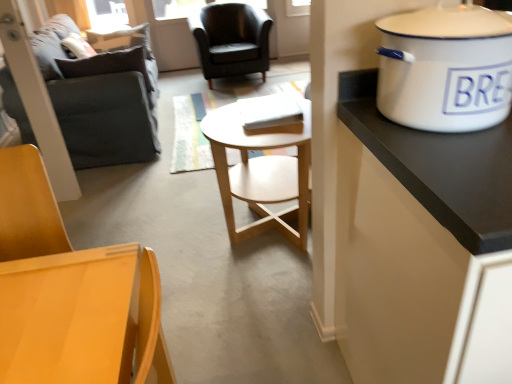
What do you see at coordinates (231, 40) in the screenshot? The width and height of the screenshot is (512, 384). I see `matte black armchair at center, the 1th chair viewed from the back` at bounding box center [231, 40].

What do you see at coordinates (71, 293) in the screenshot? This screenshot has height=384, width=512. I see `matte wood chair at lower left, placed as the 1th chair when sorted from front to back` at bounding box center [71, 293].

Locate an element on the screen. light wood/woodenobject at center is located at coordinates (262, 168).

What do you see at coordinates (445, 68) in the screenshot? This screenshot has width=512, height=384. I see `white enamel cooker at upper right` at bounding box center [445, 68].

Where is `white enamel cooker at upper right`? The height and width of the screenshot is (384, 512). white enamel cooker at upper right is located at coordinates [445, 68].

Where is `matte black armchair at center, the 2th chair in the front-to-back sequence`? matte black armchair at center, the 2th chair in the front-to-back sequence is located at coordinates (231, 40).

From a real-world perspective, who is located lower, dark gray fabric couch at left or matte black armchair at center, which appears as the first chair when viewed from the top?

matte black armchair at center, which appears as the first chair when viewed from the top, from a real-world perspective.

Based on their positions, is dark gray fabric couch at left located to the left or right of matte black armchair at center, which appears as the first chair when viewed from the top?

A: dark gray fabric couch at left is positioned on matte black armchair at center, which appears as the first chair when viewed from the top,'s left side.

Is dark gray fabric couch at left in front of matte black armchair at center, the 1th chair viewed from the back?

Yes, it is in front of matte black armchair at center, the 1th chair viewed from the back.

Looking at this image, which of these two, dark gray fabric couch at left or matte black armchair at center, which appears as the first chair when viewed from the top, stands taller?

dark gray fabric couch at left is taller.

Between light wood/woodenobject at center and matte black armchair at center, the 1th chair viewed from the back, which one appears on the left side from the viewer's perspective?

matte black armchair at center, the 1th chair viewed from the back, is more to the left.

Is point (238, 136) behind point (203, 8)?

No.

In the image, there is a matte black armchair at center, the 2th chair in the front-to-back sequence. At what (x,y) coordinates should I click in order to perform the action: click on coffee table below it (from the image's perspective). Please return your answer as a coordinate pair (x, y). The image size is (512, 384). Looking at the image, I should click on (262, 168).

Is the depth of light wood/woodenobject at center greater than that of matte black armchair at center, the 2th chair in the front-to-back sequence?

That is False.

Is light wood/woodenobject at center shorter than dark gray fabric couch at left?

Correct, light wood/woodenobject at center is not as tall as dark gray fabric couch at left.

Choose the correct answer: Is light wood/woodenobject at center inside dark gray fabric couch at left or outside it?

light wood/woodenobject at center cannot be found inside dark gray fabric couch at left.

Is the depth of light wood/woodenobject at center less than that of dark gray fabric couch at left?

Yes, light wood/woodenobject at center is in front of dark gray fabric couch at left.

From the image's perspective, relative to dark gray fabric couch at left, is light wood/woodenobject at center above or below?

Clearly, from the image's perspective, light wood/woodenobject at center is below dark gray fabric couch at left.

Is white enamel cooker at upper right a part of dark gray fabric couch at left?

No.

From the image's perspective, is dark gray fabric couch at left on white enamel cooker at upper right?

Yes, from the image's perspective, dark gray fabric couch at left is above white enamel cooker at upper right.

Which of these two, dark gray fabric couch at left or white enamel cooker at upper right, stands shorter?

With less height is white enamel cooker at upper right.

Consider the image. Between dark gray fabric couch at left and white enamel cooker at upper right, which one has larger size?

dark gray fabric couch at left is bigger.

Is white enamel cooker at upper right placed right next to matte black armchair at center, which appears as the 2th chair when ordered from the bottom?

No, white enamel cooker at upper right is not next to matte black armchair at center, which appears as the 2th chair when ordered from the bottom.

Can you confirm if white enamel cooker at upper right is wider than matte black armchair at center, the 2th chair in the front-to-back sequence?

No.

Is white enamel cooker at upper right oriented towards matte black armchair at center, which appears as the first chair when viewed from the top?

No, white enamel cooker at upper right does not turn towards matte black armchair at center, which appears as the first chair when viewed from the top.

Based on the photo, which of these two, matte black armchair at center, the 1th chair viewed from the back, or light wood/woodenobject at center, stands taller?

matte black armchair at center, the 1th chair viewed from the back.

Is matte black armchair at center, the 1th chair viewed from the back, positioned before light wood/woodenobject at center?

No, it is behind light wood/woodenobject at center.

From the image's perspective, relative to light wood/woodenobject at center, is matte black armchair at center, which appears as the 2th chair when ordered from the bottom, above or below?

Based on their image positions, matte black armchair at center, which appears as the 2th chair when ordered from the bottom, is located above light wood/woodenobject at center.

How many degrees apart are the facing directions of matte black armchair at center, the 2th chair in the front-to-back sequence, and light wood/woodenobject at center?

180 degrees.

Is dark gray fabric couch at left completely or partially outside of matte wood chair at lower left, the second chair viewed from the back?

That's correct, dark gray fabric couch at left is outside of matte wood chair at lower left, the second chair viewed from the back.

Relative to matte wood chair at lower left, the second chair viewed from the back, is dark gray fabric couch at left in front or behind?

dark gray fabric couch at left is positioned farther from the viewer than matte wood chair at lower left, the second chair viewed from the back.

Identify the location of studio couch behind the matte wood chair at lower left, placed as the 1th chair when sorted from front to back. The height and width of the screenshot is (384, 512). (100, 99).

Between point (85, 122) and point (17, 307), which one is positioned in front?

The point (17, 307) is more forward.

Image resolution: width=512 pixels, height=384 pixels. What are the coordinates of `chair behind the dark gray fabric couch at left` in the screenshot? It's located at (231, 40).

From a real-world perspective, starting from the light wood/woodenobject at center, which chair is the 1st one vertically above it? Please provide its 2D coordinates.

[(231, 40)]

When comparing their distances from white enamel cooker at upper right, does matte black armchair at center, which appears as the 2th chair when ordered from the bottom, or matte wood chair at lower left, the second chair viewed from the back, seem closer?

matte wood chair at lower left, the second chair viewed from the back, lies closer to white enamel cooker at upper right than the other object.

Considering their positions, is white enamel cooker at upper right positioned further to matte wood chair at lower left, positioned as the first chair in bottom-to-top order, than matte black armchair at center, which appears as the 2th chair when ordered from the bottom?

The object further to matte wood chair at lower left, positioned as the first chair in bottom-to-top order, is matte black armchair at center, which appears as the 2th chair when ordered from the bottom.

From the image, which object appears to be farther from light wood/woodenobject at center, dark gray fabric couch at left or matte wood chair at lower left, placed as the second chair when sorted from top to bottom?

dark gray fabric couch at left is further to light wood/woodenobject at center.

Based on their spatial positions, is dark gray fabric couch at left or white enamel cooker at upper right further from matte wood chair at lower left, placed as the 1th chair when sorted from front to back?

Based on the image, dark gray fabric couch at left appears to be further to matte wood chair at lower left, placed as the 1th chair when sorted from front to back.

Which object lies nearer to the anchor point matte wood chair at lower left, the second chair viewed from the back, matte black armchair at center, the 1th chair viewed from the back, or dark gray fabric couch at left?

dark gray fabric couch at left is positioned closer to the anchor matte wood chair at lower left, the second chair viewed from the back.

Which object lies nearer to the anchor point matte black armchair at center, which appears as the first chair when viewed from the top, matte wood chair at lower left, placed as the 1th chair when sorted from front to back, or white enamel cooker at upper right?

matte wood chair at lower left, placed as the 1th chair when sorted from front to back, is positioned closer to the anchor matte black armchair at center, which appears as the first chair when viewed from the top.

Based on their spatial positions, is matte wood chair at lower left, placed as the second chair when sorted from top to bottom, or dark gray fabric couch at left closer to matte black armchair at center, the 2th chair in the front-to-back sequence?

dark gray fabric couch at left.

Looking at the image, which one is located further to matte black armchair at center, the 2th chair in the front-to-back sequence, dark gray fabric couch at left or matte wood chair at lower left, placed as the 1th chair when sorted from front to back?

Based on the image, matte wood chair at lower left, placed as the 1th chair when sorted from front to back, appears to be further to matte black armchair at center, the 2th chair in the front-to-back sequence.

Locate an element on the screen. coffee table positioned between matte wood chair at lower left, placed as the second chair when sorted from top to bottom, and matte black armchair at center, the 2th chair in the front-to-back sequence, from near to far is located at coordinates (262, 168).

Find the location of a particular element. This screenshot has height=384, width=512. coffee table between dark gray fabric couch at left and white enamel cooker at upper right in the horizontal direction is located at coordinates (262, 168).

The image size is (512, 384). Identify the location of coffee table between white enamel cooker at upper right and matte black armchair at center, the 2th chair in the front-to-back sequence, from front to back. (262, 168).

Where is `studio couch located between light wood/woodenobject at center and matte black armchair at center, the 2th chair in the front-to-back sequence, in the depth direction`? studio couch located between light wood/woodenobject at center and matte black armchair at center, the 2th chair in the front-to-back sequence, in the depth direction is located at coordinates (100, 99).